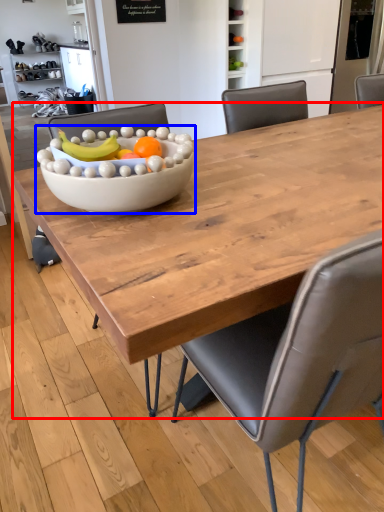
Question: Which object appears closest to the camera in this image, coffee table (highlighted by a red box) or bowl (highlighted by a blue box)?

Choices:
 (A) coffee table
 (B) bowl

Answer: (A)